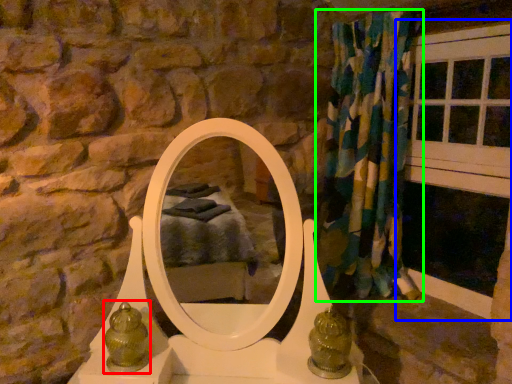
Question: Based on their relative distances, which object is nearer to antique (highlighted by a red box)? Choose from window frame (highlighted by a blue box) and curtain (highlighted by a green box).

Choices:
 (A) window frame
 (B) curtain

Answer: (B)